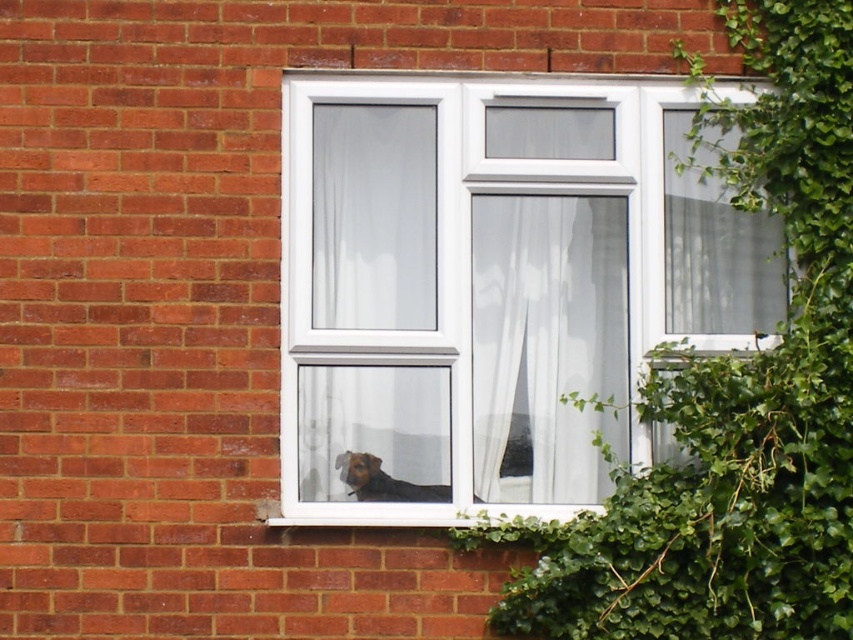
Question: Is white sheer curtain at center positioned in front of brown fur dog at lower center?

Choices:
 (A) no
 (B) yes

Answer: (A)

Question: Is white plastic window at center below brown fur dog at lower center?

Choices:
 (A) no
 (B) yes

Answer: (A)

Question: Is white sheer curtain at center above white plastic window sill at lower center?

Choices:
 (A) no
 (B) yes

Answer: (B)

Question: Which point is closer to the camera?

Choices:
 (A) brown fur dog at lower center
 (B) white plastic window at center

Answer: (B)

Question: Which object appears closest to the camera in this image?

Choices:
 (A) brown fur dog at lower center
 (B) white plastic window sill at lower center
 (C) green leafy ivy at right

Answer: (C)

Question: Which of these objects is positioned farthest from the white sheer curtain at center?

Choices:
 (A) green leafy ivy at right
 (B) brown fur dog at lower center

Answer: (B)